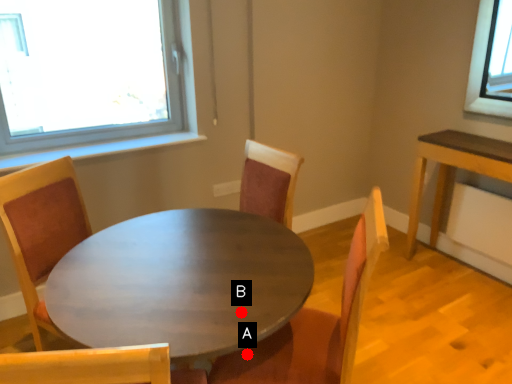
Question: Two points are circled on the image, labeled by A and B beside each circle. Which point is farther to the camera?

Choices:
 (A) A is further
 (B) B is further

Answer: (A)